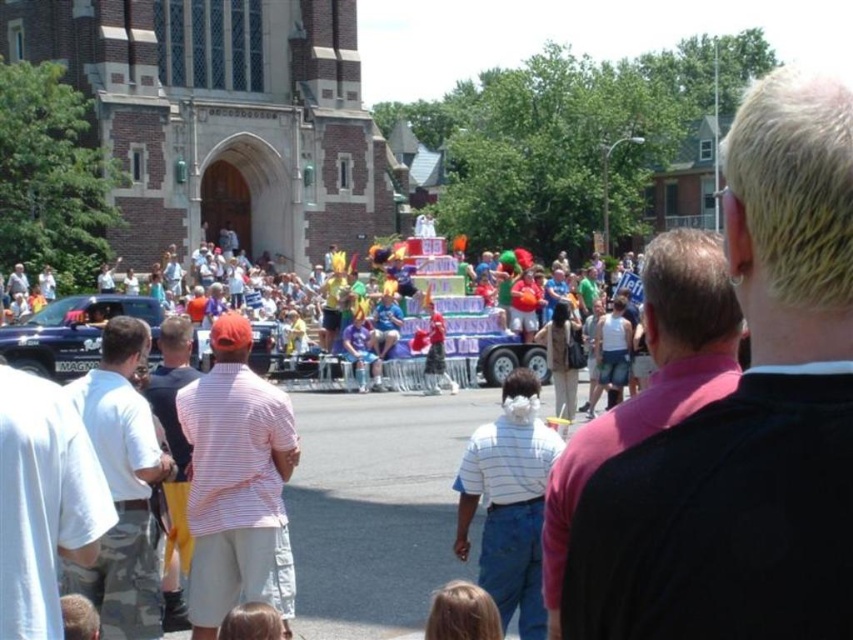
Question: Does multicolored balloons at center come behind metallic blue truck at left?

Choices:
 (A) no
 (B) yes

Answer: (A)

Question: Considering the real-world distances, which object is closest to the white striped shirt at center?

Choices:
 (A) pink fabric shirt at upper right
 (B) pink fabric shirt at center

Answer: (B)

Question: Can you confirm if striped cotton shirt at center is thinner than pink fabric shirt at center?

Choices:
 (A) no
 (B) yes

Answer: (B)

Question: Which point is closer to the camera taking this photo?

Choices:
 (A) (657, 362)
 (B) (495, 440)
 (C) (96, 356)

Answer: (A)

Question: Is white striped shirt at center above metallic blue truck at left?

Choices:
 (A) yes
 (B) no

Answer: (B)

Question: Which of the following is the farthest from the observer?

Choices:
 (A) (692, 337)
 (B) (808, 620)

Answer: (A)